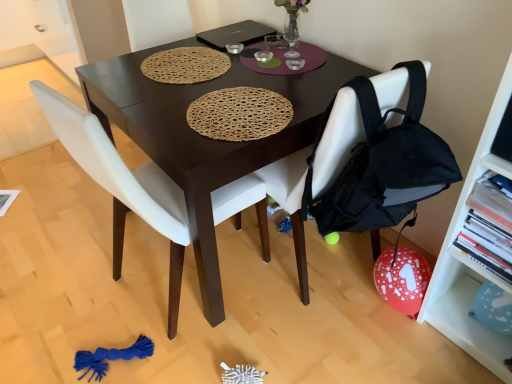
Where is `vacant area that lies between white matte chair at center, arranged as the 2th chair when viewed from the right, and dark wood table at center`? This screenshot has height=384, width=512. vacant area that lies between white matte chair at center, arranged as the 2th chair when viewed from the right, and dark wood table at center is located at coordinates (133, 265).